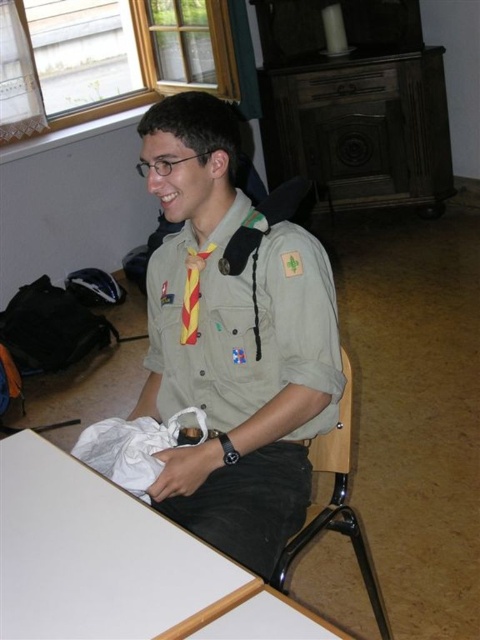
What object is located at the coordinates point (98, 556) in the scene?

The point (98, 556) corresponds to the white matte table at lower left.

You are standing in the room where the young individual is seated. The white matte table at lower left is located at coordinates point 0.870, 0.206. If you want to place a small object on the table, where should you aim?

You should aim for the coordinates point (98,556) where the white matte table at lower left is located to place the small object.

You are a tailor trying to determine if the khaki fabric uniform at center can be stored vertically in a closet next to the metallic black chair at lower right. Based on their heights, will the uniform fit without bending it?

The khaki fabric uniform at center is taller than the metallic black chair at lower right. Since the uniform is taller, it might not fit vertically in the closet next to the chair without bending, as it exceeds the chair height.